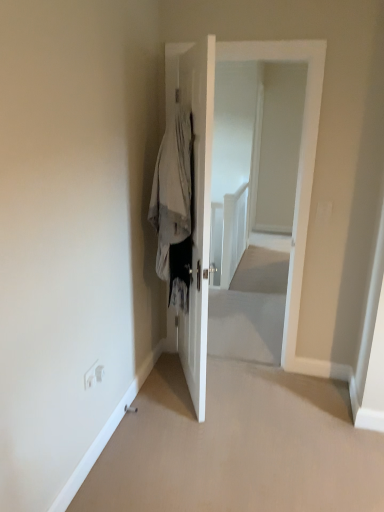
Where is `white glossy door at center, placed as the 1th door when sorted from left to right`? white glossy door at center, placed as the 1th door when sorted from left to right is located at coordinates (198, 213).

You are a GUI agent. You are given a task and a screenshot of the screen. Output one action in this format:
    pyautogui.click(x=<x>, y=<y>)
    Task: Click on the white glossy door at center, placed as the 1th door when sorted from left to right
    The height and width of the screenshot is (512, 384).
    Given the screenshot: What is the action you would take?
    coord(198,213)

Does white glossy door at center, positioned as the 2th door in right-to-left order, have a greater height compared to white glossy door at center, marked as the second door in a left-to-right arrangement?

No.

Is white glossy door at center, placed as the 1th door when sorted from left to right, in front of or behind white glossy door at center, marked as the second door in a left-to-right arrangement, in the image?

white glossy door at center, placed as the 1th door when sorted from left to right, is positioned closer to the viewer than white glossy door at center, marked as the second door in a left-to-right arrangement.

Could you tell me if white glossy door at center, placed as the 1th door when sorted from left to right, is facing white glossy door at center, marked as the second door in a left-to-right arrangement?

Yes, white glossy door at center, placed as the 1th door when sorted from left to right, is facing white glossy door at center, marked as the second door in a left-to-right arrangement.

How many degrees apart are the facing directions of white glossy door at center, positioned as the 2th door in right-to-left order, and white glossy door at center, which is the first door in right-to-left order?

113 degrees.

Would you say white glossy door at center, positioned as the 2th door in right-to-left order, is part of light gray fabric coat at center's contents?

No, white glossy door at center, positioned as the 2th door in right-to-left order, is not surrounded by light gray fabric coat at center.

Who is smaller, light gray fabric coat at center or white glossy door at center, placed as the 1th door when sorted from left to right?

light gray fabric coat at center.

How many degrees apart are the facing directions of light gray fabric coat at center and white glossy door at center, positioned as the 2th door in right-to-left order?

The angle between the facing direction of light gray fabric coat at center and the facing direction of white glossy door at center, positioned as the 2th door in right-to-left order, is 180 degrees.

Measure the distance from light gray fabric coat at center to white glossy door at center, placed as the 1th door when sorted from left to right.

light gray fabric coat at center and white glossy door at center, placed as the 1th door when sorted from left to right, are 5.90 inches apart.

Can you confirm if white glossy door at center, marked as the second door in a left-to-right arrangement, is thinner than white glossy door at center, placed as the 1th door when sorted from left to right?

No.

Which object is closer to the camera taking this photo, white glossy door at center, which is the first door in right-to-left order, or white glossy door at center, placed as the 1th door when sorted from left to right?

white glossy door at center, placed as the 1th door when sorted from left to right, is in front.

Is point (301, 261) farther from viewer compared to point (199, 106)?

Yes, point (301, 261) is farther from viewer.

Is white glossy door at center, marked as the second door in a left-to-right arrangement, to the right of white glossy door at center, positioned as the 2th door in right-to-left order, from the viewer's perspective?

Indeed, white glossy door at center, marked as the second door in a left-to-right arrangement, is positioned on the right side of white glossy door at center, positioned as the 2th door in right-to-left order.

From the image's perspective, is white glossy door at center, marked as the second door in a left-to-right arrangement, above light gray fabric coat at center?

Yes, from the image's perspective, white glossy door at center, marked as the second door in a left-to-right arrangement, is on top of light gray fabric coat at center.

Is white glossy door at center, which is the first door in right-to-left order, touching light gray fabric coat at center?

white glossy door at center, which is the first door in right-to-left order, is not next to light gray fabric coat at center, and they're not touching.

Which object is thinner, white glossy door at center, marked as the second door in a left-to-right arrangement, or light gray fabric coat at center?

white glossy door at center, marked as the second door in a left-to-right arrangement, is thinner.

In terms of width, does light gray fabric coat at center look wider or thinner when compared to white glossy door at center, marked as the second door in a left-to-right arrangement?

In the image, light gray fabric coat at center appears to be wider than white glossy door at center, marked as the second door in a left-to-right arrangement.

Is light gray fabric coat at center facing towards white glossy door at center, marked as the second door in a left-to-right arrangement?

No, light gray fabric coat at center is not oriented towards white glossy door at center, marked as the second door in a left-to-right arrangement.

Image resolution: width=384 pixels, height=512 pixels. Find the location of `clothing located on the left of white glossy door at center, which is the first door in right-to-left order`. clothing located on the left of white glossy door at center, which is the first door in right-to-left order is located at coordinates (175, 208).

Based on their positions, is white glossy door at center, positioned as the 2th door in right-to-left order, located to the left or right of light gray fabric coat at center?

From the image, it's evident that white glossy door at center, positioned as the 2th door in right-to-left order, is to the right of light gray fabric coat at center.

From a real-world perspective, is white glossy door at center, placed as the 1th door when sorted from left to right, located beneath light gray fabric coat at center?

Yes.

Is white glossy door at center, positioned as the 2th door in right-to-left order, positioned beyond the bounds of light gray fabric coat at center?

Indeed, white glossy door at center, positioned as the 2th door in right-to-left order, is completely outside light gray fabric coat at center.

At what (x,y) coordinates should I click in order to perform the action: click on clothing that is above the white glossy door at center, placed as the 1th door when sorted from left to right (from the image's perspective). Please return your answer as a coordinate pair (x, y). This screenshot has width=384, height=512. Looking at the image, I should click on (175, 208).

At what (x,y) coordinates should I click in order to perform the action: click on door above the white glossy door at center, placed as the 1th door when sorted from left to right (from a real-world perspective). Please return your answer as a coordinate pair (x, y). The width and height of the screenshot is (384, 512). Looking at the image, I should click on (212, 140).

Where is `door that is the 2nd one below the light gray fabric coat at center (from a real-world perspective)`? door that is the 2nd one below the light gray fabric coat at center (from a real-world perspective) is located at coordinates (198, 213).

Which object lies further to the anchor point light gray fabric coat at center, white glossy door at center, positioned as the 2th door in right-to-left order, or white glossy door at center, marked as the second door in a left-to-right arrangement?

Based on the image, white glossy door at center, marked as the second door in a left-to-right arrangement, appears to be further to light gray fabric coat at center.

Looking at the image, which one is located closer to light gray fabric coat at center, white glossy door at center, marked as the second door in a left-to-right arrangement, or white glossy door at center, placed as the 1th door when sorted from left to right?

white glossy door at center, placed as the 1th door when sorted from left to right, is positioned closer to the anchor light gray fabric coat at center.

When comparing their distances from white glossy door at center, marked as the second door in a left-to-right arrangement, does light gray fabric coat at center or white glossy door at center, placed as the 1th door when sorted from left to right, seem closer?

white glossy door at center, placed as the 1th door when sorted from left to right, lies closer to white glossy door at center, marked as the second door in a left-to-right arrangement, than the other object.

From the image, which object appears to be farther from white glossy door at center, marked as the second door in a left-to-right arrangement, white glossy door at center, positioned as the 2th door in right-to-left order, or light gray fabric coat at center?

light gray fabric coat at center is positioned further to the anchor white glossy door at center, marked as the second door in a left-to-right arrangement.

Which object lies further to the anchor point white glossy door at center, positioned as the 2th door in right-to-left order, light gray fabric coat at center or white glossy door at center, which is the first door in right-to-left order?

white glossy door at center, which is the first door in right-to-left order, lies further to white glossy door at center, positioned as the 2th door in right-to-left order, than the other object.

Looking at the image, which one is located closer to white glossy door at center, positioned as the 2th door in right-to-left order, white glossy door at center, marked as the second door in a left-to-right arrangement, or light gray fabric coat at center?

light gray fabric coat at center.

This screenshot has height=512, width=384. I want to click on clothing between white glossy door at center, placed as the 1th door when sorted from left to right, and white glossy door at center, which is the first door in right-to-left order, from front to back, so click(175, 208).